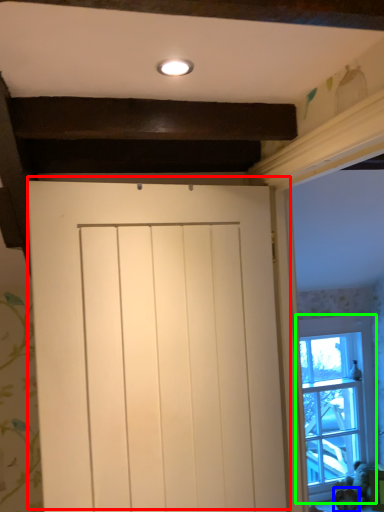
Question: Which is farther away from door (highlighted by a red box)? animal (highlighted by a blue box) or window (highlighted by a green box)?

Choices:
 (A) animal
 (B) window

Answer: (A)